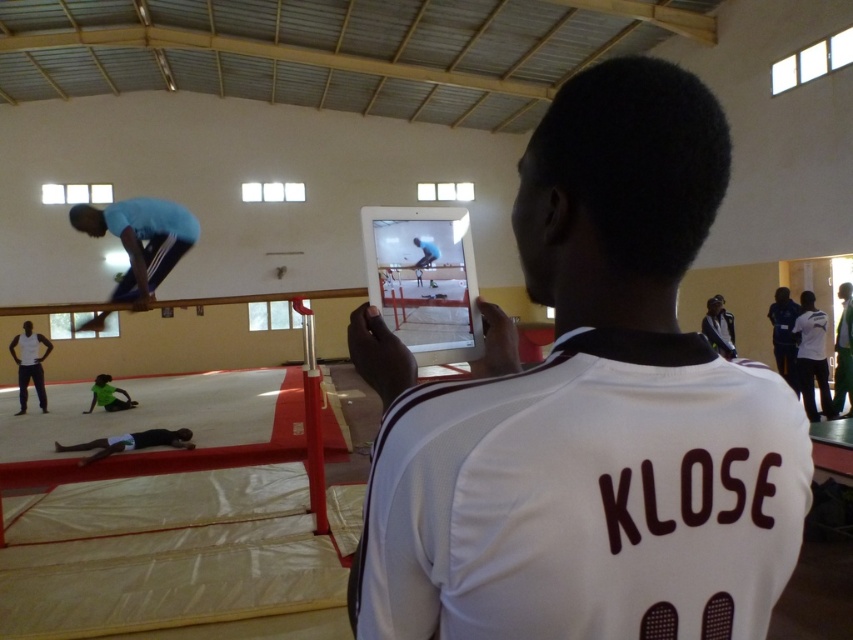
Does point (601, 416) come behind point (167, 224)?

No, (601, 416) is in front of (167, 224).

Consider the image. Who is lower down, white jersey at center or blue fabric pants at upper center?

Positioned lower is white jersey at center.

Is point (602, 474) farther from viewer compared to point (148, 284)?

No, (602, 474) is closer to viewer.

Where is `white jersey at center`? The image size is (853, 640). white jersey at center is located at coordinates click(589, 410).